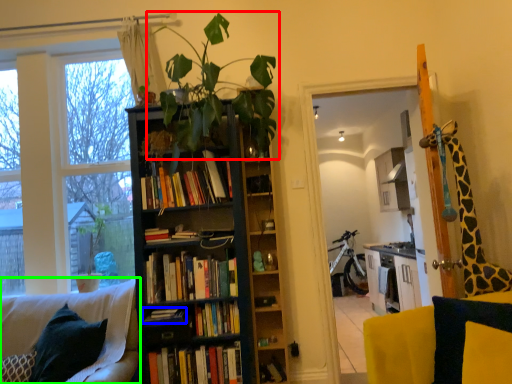
Question: Considering the real-world distances, which object is closest to houseplant (highlighted by a red box)? book (highlighted by a blue box) or chair (highlighted by a green box).

Choices:
 (A) book
 (B) chair

Answer: (B)